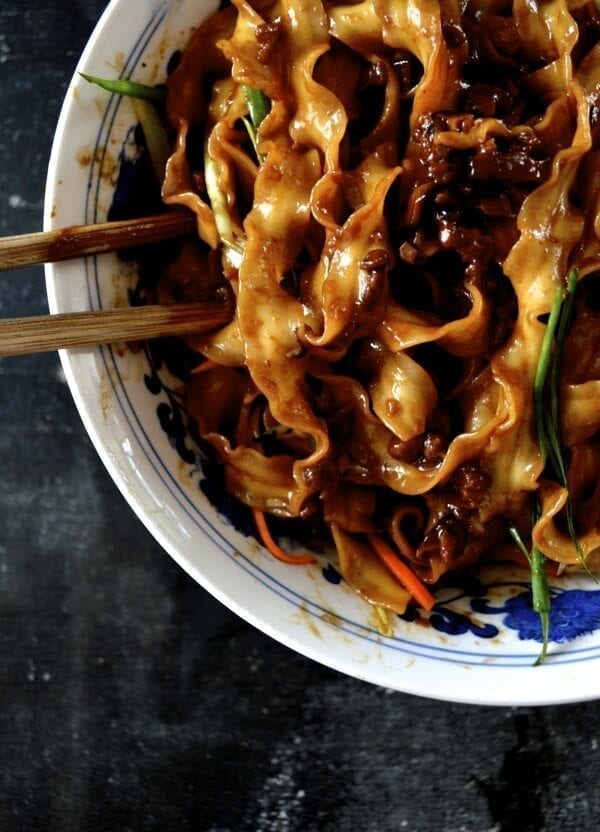
At what (x,y) coordinates should I click in order to perform the action: click on chopsticks. Please return your answer as a coordinate pair (x, y). Image resolution: width=600 pixels, height=832 pixels. Looking at the image, I should click on (87, 329), (51, 246).